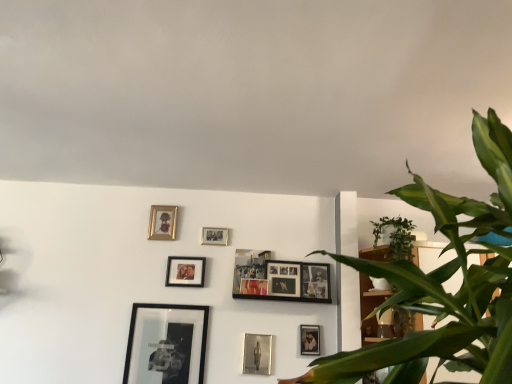
Question: From a real-world perspective, is wooden photo frame at center, the eighth picture frame when ordered from left to right, physically located above or below wooden bookshelf at right?

Choices:
 (A) below
 (B) above

Answer: (B)

Question: From the image's perspective, relative to wooden bookshelf at right, is wooden photo frame at center, the eighth picture frame when ordered from left to right, above or below?

Choices:
 (A) above
 (B) below

Answer: (B)

Question: Which is farther from the matte black picture frame at center, arranged as the 6th picture frame when viewed from the left?

Choices:
 (A) black matte picture frame at lower left, arranged as the second picture frame when viewed from the left
 (B) green leafy plant at right
 (C) matte black picture frame at center, the eighth picture frame in the right-to-left sequence
 (D) metallic silver photo frame at lower center, which is the fourth picture frame from right to left
 (E) wooden bookshelf at right

Answer: (B)

Question: Estimate the real-world distances between objects in this image. Which object is closer to the green leafy plant at right?

Choices:
 (A) matte black picture frame at center, which is the 5th picture frame from left to right
 (B) black matte picture frame at lower left, arranged as the second picture frame when viewed from the left
 (C) wooden photo frame at center, the eighth picture frame when ordered from left to right
 (D) metallic silver photo frame at lower center, which is the fourth picture frame from right to left
 (E) matte black picture frame at lower center, the ninth picture frame from the left

Answer: (C)